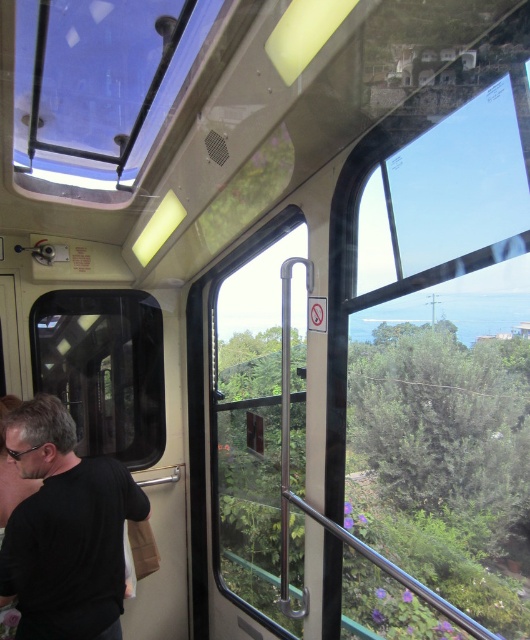
Which is more to the right, clear glass window at center or black matte shirt at left?

clear glass window at center

Does clear glass window at center lie behind black matte shirt at left?

Yes, it is.

Locate an element on the screen. clear glass window at center is located at coordinates (251, 422).

Can you confirm if transparent glass window at upper right is taller than transparent plastic window at upper center?

Yes, transparent glass window at upper right is taller than transparent plastic window at upper center.

Is transparent glass window at upper right to the left of transparent plastic window at upper center from the viewer's perspective?

No, transparent glass window at upper right is not to the left of transparent plastic window at upper center.

Which is in front, point (467, 397) or point (148, 81)?

Point (148, 81)

This screenshot has height=640, width=530. Find the location of `transparent glass window at upper right`. transparent glass window at upper right is located at coordinates (446, 362).

Find the location of a particular element. transparent plastic window at upper center is located at coordinates (90, 83).

Measure the distance between transparent plastic window at upper center and transparent glass window at center.

transparent plastic window at upper center is 3.76 feet from transparent glass window at center.

Which is behind, point (104, 8) or point (48, 301)?

Positioned behind is point (48, 301).

The width and height of the screenshot is (530, 640). What are the coordinates of `transparent plastic window at upper center` in the screenshot? It's located at (90, 83).